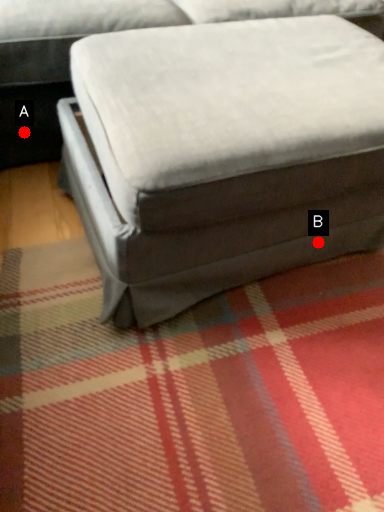
Question: Two points are circled on the image, labeled by A and B beside each circle. Which point appears closest to the camera in this image?

Choices:
 (A) A is closer
 (B) B is closer

Answer: (B)